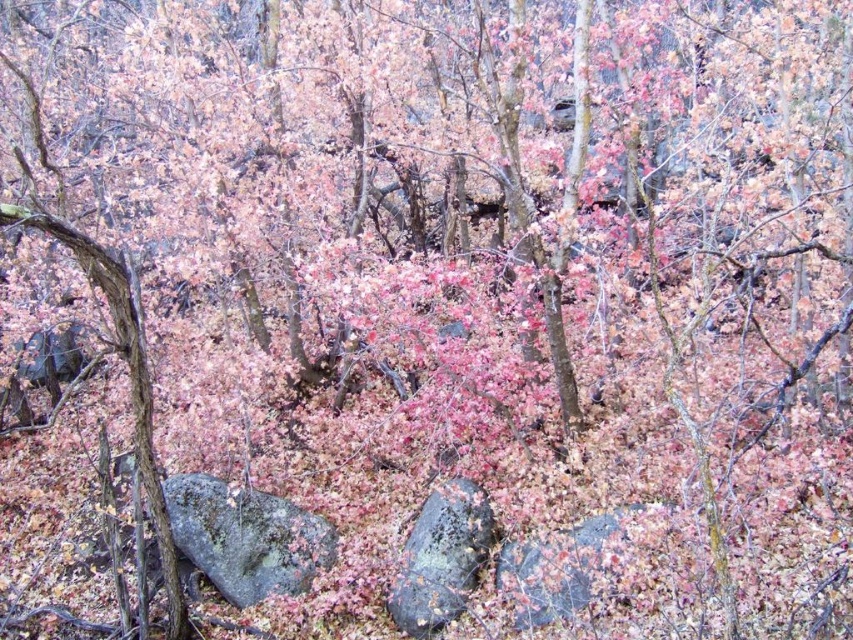
Question: Which of these objects is positioned farthest from the gray rough rock at lower left?

Choices:
 (A) gray/mossy rock at center
 (B) rusty metallic rock at center

Answer: (A)

Question: Which point is closer to the camera?

Choices:
 (A) (587, 563)
 (B) (183, 483)

Answer: (A)

Question: Does rusty metallic rock at center appear on the right side of gray/mossy rock at center?

Choices:
 (A) no
 (B) yes

Answer: (A)

Question: Is gray rough rock at lower left thinner than gray/mossy rock at center?

Choices:
 (A) yes
 (B) no

Answer: (B)

Question: Which point is closer to the camera?

Choices:
 (A) (598, 580)
 (B) (277, 502)

Answer: (A)

Question: In this image, where is gray rough rock at lower left located relative to rusty metallic rock at center?

Choices:
 (A) above
 (B) below

Answer: (A)